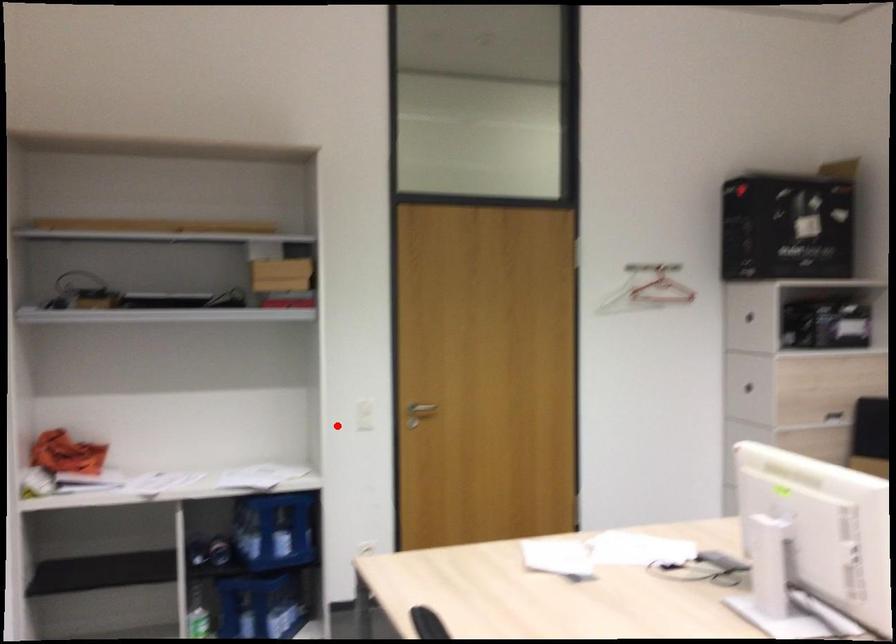
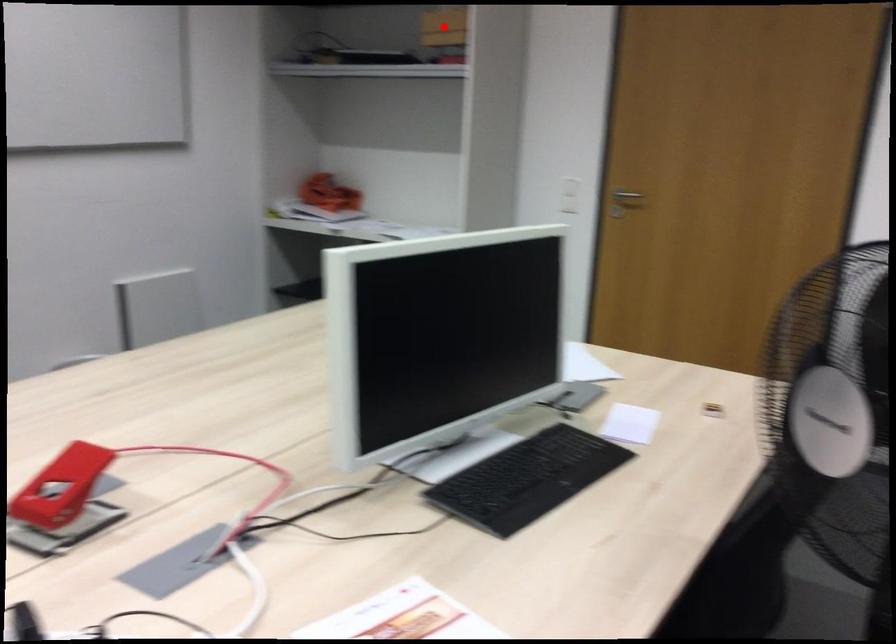
I am providing you with two images of the same scene from different viewpoints. A red point is marked on the first image and another point is marked on the second image. Is the red point in image1 aligned with the point shown in image2?

No